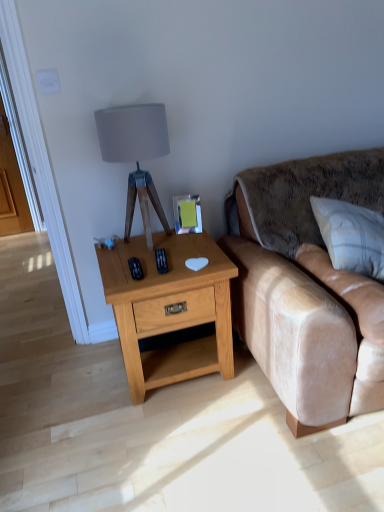
You are a GUI agent. You are given a task and a screenshot of the screen. Output one action in this format:
    pyautogui.click(x=<x>, y=<y>)
    Task: Click on the vacant space in front of matte gray fabric lampshade at upper center
    This screenshot has width=384, height=512.
    Given the screenshot: What is the action you would take?
    150,262